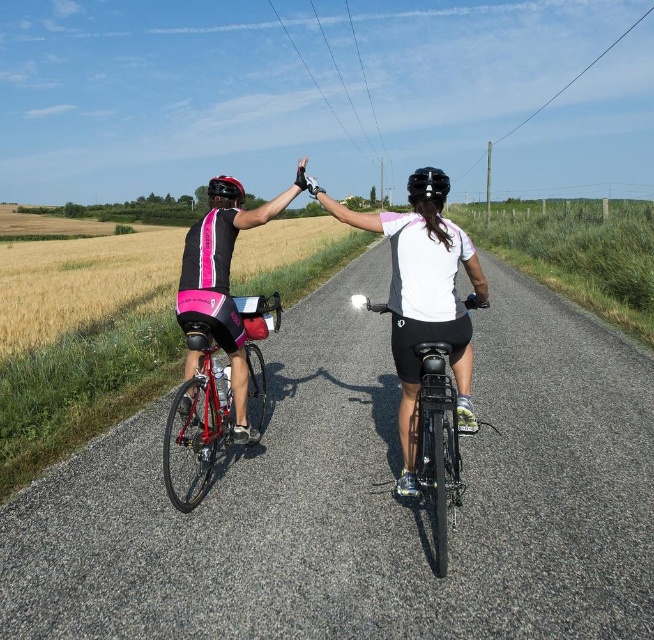
You are a photographer trying to capture both the white matte jersey at center and the black matte bicycle helmet at center in a single shot. Which object should you focus on first to ensure both are in frame?

The white matte jersey at center is smaller than the black matte bicycle helmet at center, so you should focus on the black matte bicycle helmet at center first to ensure both are in frame.

You are a photographer trying to capture a clear photo of both the black matte bicycle at center and the black matte bicycle helmet at center. Since the bicycle and helmet are positioned in a way that one is blocking the other, which object should you adjust your camera angle to focus on first to ensure both are visible in the frame?

The black matte bicycle at center is in front of the black matte bicycle helmet at center. To ensure both are visible, focus on the black matte bicycle at center first, then adjust the angle to include the helmet behind it without obstruction.